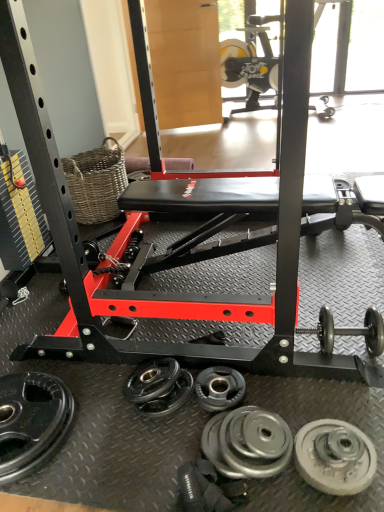
Question: From the image's perspective, is polished silver dumbbell at lower right above or below woven brown basket at upper left?

Choices:
 (A) below
 (B) above

Answer: (A)

Question: From a real-world perspective, is polished silver dumbbell at lower right above or below woven brown basket at upper left?

Choices:
 (A) above
 (B) below

Answer: (B)

Question: Considering the real-world distances, which object is farthest from the black rubber weight plate at lower left, the first wheel positioned from the left?

Choices:
 (A) black rubber weight plate at center, the 2th wheel in the left-to-right sequence
 (B) woven brown basket at upper left
 (C) polished silver dumbbell at lower right
 (D) silver metallic weight plate at lower center, which ranks as the third wheel in left-to-right order
 (E) silver metallic weight plate at lower right, marked as the fourth wheel in a left-to-right arrangement

Answer: (B)

Question: Which object is the closest to the silver metallic weight plate at lower right, marked as the fourth wheel in a left-to-right arrangement?

Choices:
 (A) woven brown basket at upper left
 (B) black rubber weight plate at center, the 2th wheel in the left-to-right sequence
 (C) polished silver dumbbell at lower right
 (D) black rubber weight plate at lower left, the 4th wheel from the right
 (E) silver metallic weight plate at lower center, which ranks as the third wheel in left-to-right order

Answer: (E)